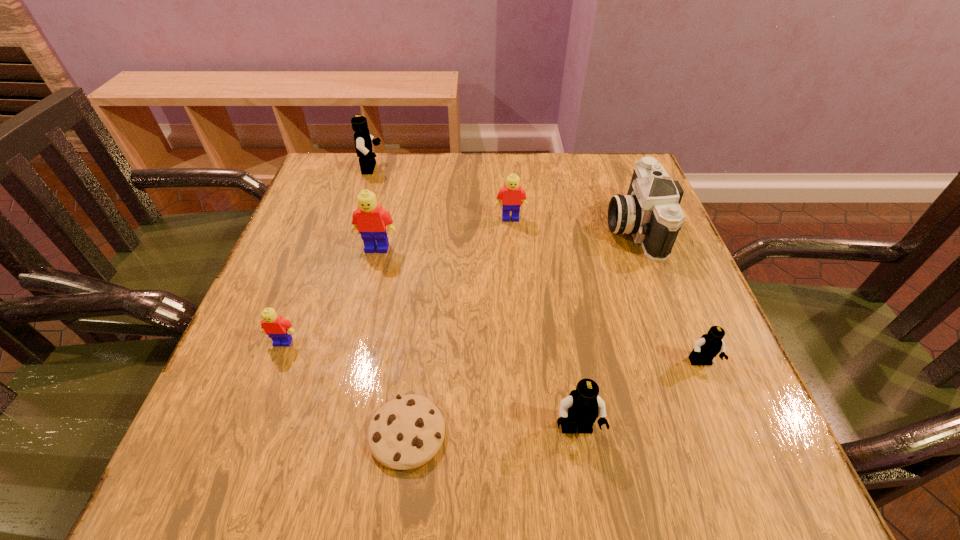
Locate an element on the screen. vacant space that is in between the shortest object and the second nearest black Lego is located at coordinates (554, 399).

Where is `vacant region between the second yellow Lego from left to right and the black camera`? The image size is (960, 540). vacant region between the second yellow Lego from left to right and the black camera is located at coordinates (506, 237).

Where is `free space between the fifth object from left to right and the nearest yellow Lego`? Image resolution: width=960 pixels, height=540 pixels. free space between the fifth object from left to right and the nearest yellow Lego is located at coordinates (396, 280).

The image size is (960, 540). Identify the location of free point between the rightmost yellow Lego and the fourth nearest object. (396, 280).

At what (x,y) coordinates should I click in order to perform the action: click on object identified as the fourth closest to the second biggest black Lego. Please return your answer as a coordinate pair (x, y). Looking at the image, I should click on (278, 329).

Identify which object is located as the nearest to the third object from right to left. Please provide its 2D coordinates. Your answer should be formatted as a tuple, i.e. [(x, y)], where the tuple contains the x and y coordinates of a point satisfying the conditions above.

[(405, 433)]

Image resolution: width=960 pixels, height=540 pixels. I want to click on Lego that stands as the closest to the biggest yellow Lego, so click(512, 195).

Find the location of `Lego that stands as the closest to the farthest Lego`. Lego that stands as the closest to the farthest Lego is located at coordinates (370, 220).

Find the location of a particular element. the second closest black Lego to the brown cookie is located at coordinates (709, 345).

This screenshot has height=540, width=960. I want to click on the second closest black Lego to the smallest black Lego, so click(363, 140).